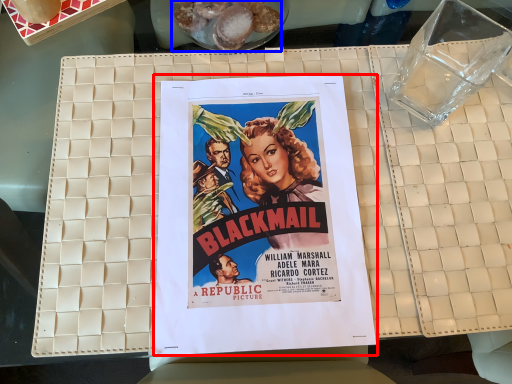
Question: Which object is further to the camera taking this photo, poster (highlighted by a red box) or food (highlighted by a blue box)?

Choices:
 (A) poster
 (B) food

Answer: (B)